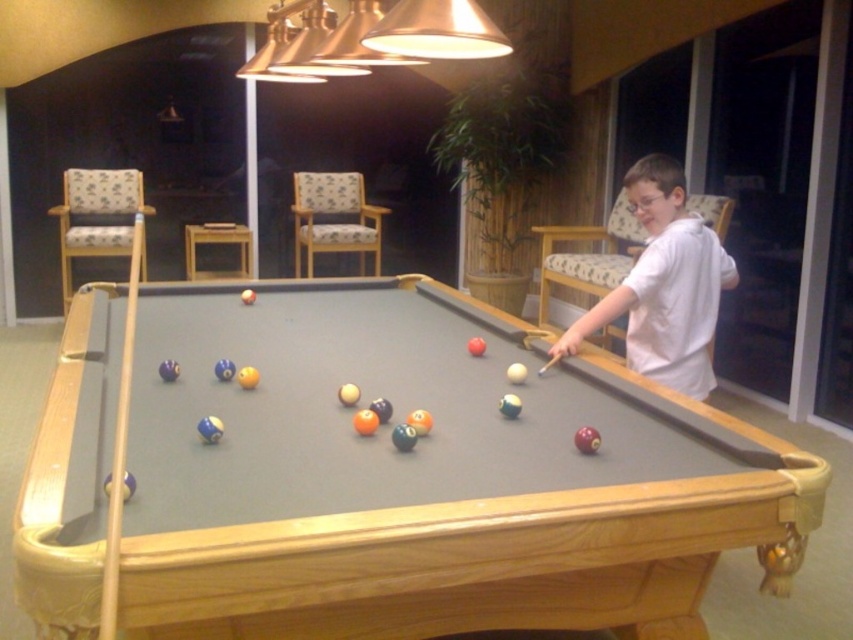
You are standing at the point with coordinates (426, 477) in the image. Based on the scene description, what object are you likely standing on?

The point at (426, 477) corresponds to the wooden billiard table at center, so you are likely standing on the wooden billiard table at center.

You are standing in the recreational space and want to move from the pool table to the chairs. You see two points marked as point (671,289) and point (123,385). Which point should you walk towards to reach the chairs without passing through the pool table?

Point (671,289) is behind point (123,385), so you should walk towards point (123,385) to reach the chairs without passing through the pool table.